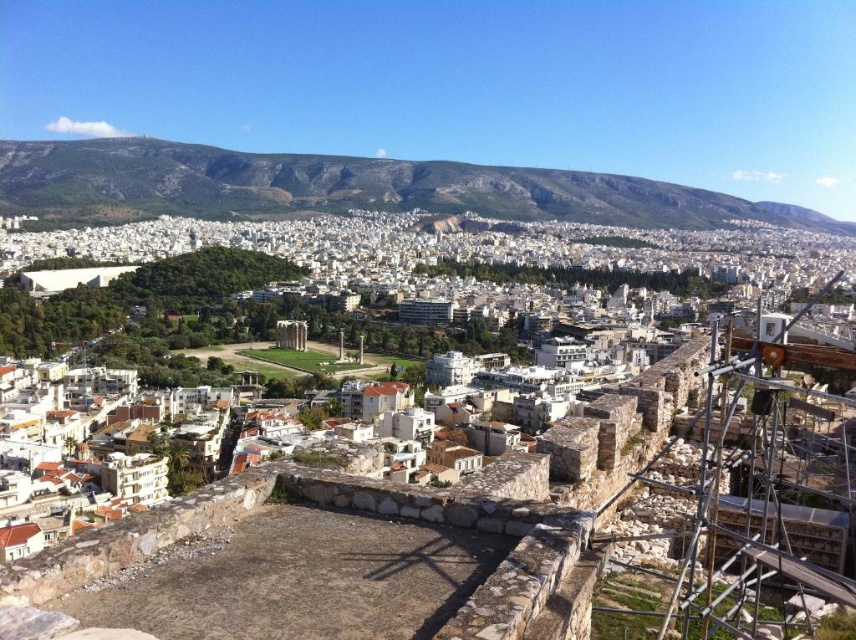
Question: Can you confirm if brown stone wall at center is positioned below rocky brown mountain at upper center?

Choices:
 (A) yes
 (B) no

Answer: (A)

Question: Is brown stone wall at center to the left of rocky brown mountain at upper center from the viewer's perspective?

Choices:
 (A) yes
 (B) no

Answer: (A)

Question: Which object appears closest to the camera in this image?

Choices:
 (A) rocky brown mountain at upper center
 (B) brown stone wall at center

Answer: (B)

Question: Observing the image, what is the correct spatial positioning of brown stone wall at center in reference to rocky brown mountain at upper center?

Choices:
 (A) right
 (B) left

Answer: (B)